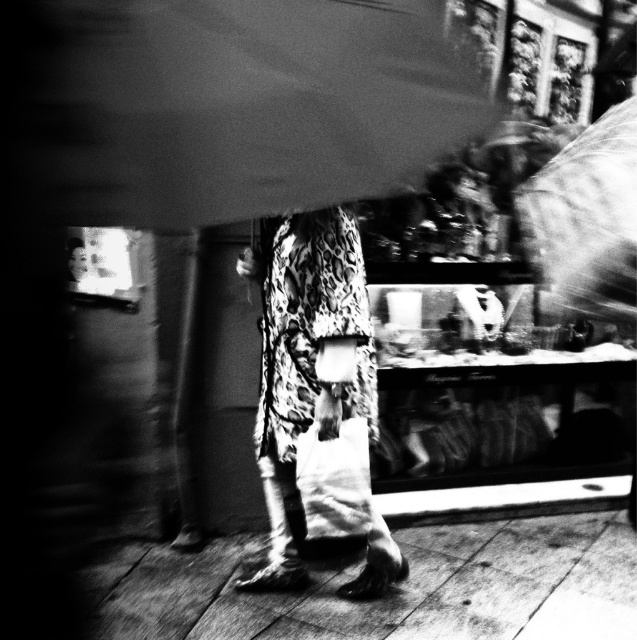
You are a delivery person trying to place a large package on the smooth wooden floor at lower center. However, there is a transparent plastic umbrella at upper right nearby. Can you fit the package on the floor without touching the umbrella?

The smooth wooden floor at lower center might be wider than transparent plastic umbrella at upper right, so there is a possibility that the package can be placed without touching the umbrella, but it depends on the exact dimensions and positioning.

Looking at this image, you are designing a display for a small boutique store. You have a smooth fabric umbrella at upper center and a smooth wooden floor at lower center. Given their sizes, which object would be more suitable to place in a narrow hallway that is only 1 meter wide?

The smooth fabric umbrella at upper center has a smaller width than the smooth wooden floor at lower center, so it would be more suitable to place in a narrow hallway that is only 1 meter wide since it requires less space.

You are an interior designer planning to place a new decorative item in the scene. You have a small statue that is 20 cm tall. Considering the smooth fabric umbrella at upper center and the smooth wooden floor at lower center, which object would be a suitable height for placing the statue so it can be easily seen?

The smooth fabric umbrella at upper center has a greater height compared to the smooth wooden floor at lower center. Therefore, placing the statue on the smooth wooden floor at lower center would ensure it is visible since the floor is lower and the statue can be seen without obstruction from the taller umbrella.